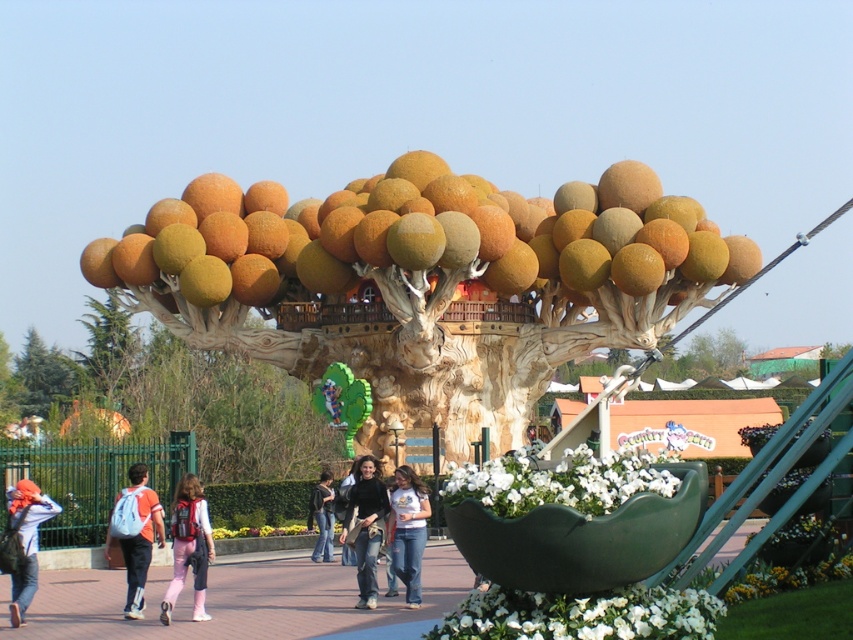
You are a visitor at this magical tree and notice the matte orange spheres at center and the matte pink pants at center. Which object is bigger in size?

The matte orange spheres at center is larger in size than the matte pink pants at center.

You are a visitor at this amusement park and you want to pick up your denim jacket at center without moving your light blue backpack at lower left. Is this possible?

The light blue backpack at lower left is located above the denim jacket at center, so you can pick up the denim jacket at center without moving the backpack since it is positioned below.

You are a visitor at this amusement park and want to take a photo of the matte orange spheres at center and the green leafy tree at left. Which object should you focus on first if you want to capture both in a single frame without moving the camera?

The matte orange spheres at center should be focused on first because they are positioned over the green leafy tree at left, meaning they are closer to the camera. By focusing on the closer object, both will be in focus if they are within the depth of field.